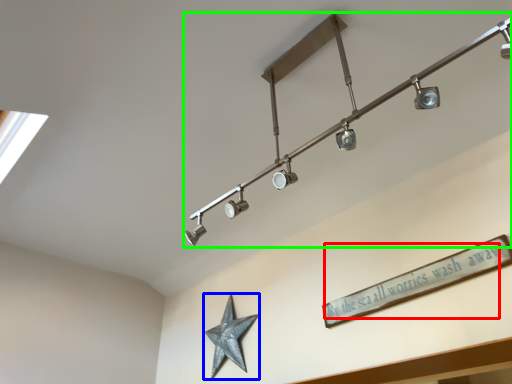
Question: Which is nearer to the writing (highlighted by a red box)? star (highlighted by a blue box) or lamp (highlighted by a green box).

Choices:
 (A) star
 (B) lamp

Answer: (B)